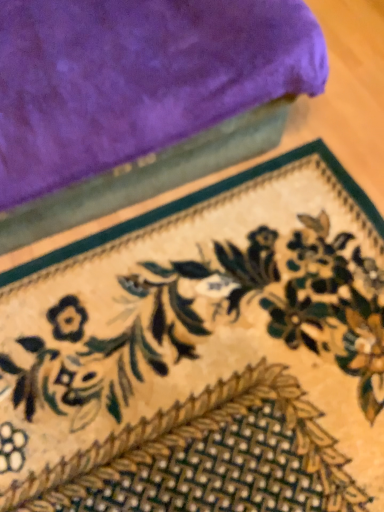
Question: Is floral-patterned carpet at lower center spatially inside velvet purple towel at upper left, or outside of it?

Choices:
 (A) outside
 (B) inside

Answer: (A)

Question: Relative to velvet purple towel at upper left, is floral-patterned carpet at lower center in front or behind?

Choices:
 (A) behind
 (B) front

Answer: (A)

Question: From the image's perspective, is floral-patterned carpet at lower center above or below velvet purple towel at upper left?

Choices:
 (A) above
 (B) below

Answer: (B)

Question: Considering the positions of velvet purple towel at upper left and floral-patterned carpet at lower center in the image, is velvet purple towel at upper left wider or thinner than floral-patterned carpet at lower center?

Choices:
 (A) thin
 (B) wide

Answer: (A)

Question: Based on their positions, is velvet purple towel at upper left located to the left or right of floral-patterned carpet at lower center?

Choices:
 (A) right
 (B) left

Answer: (B)

Question: Based on their sizes in the image, would you say velvet purple towel at upper left is bigger or smaller than floral-patterned carpet at lower center?

Choices:
 (A) big
 (B) small

Answer: (A)

Question: From a real-world perspective, is velvet purple towel at upper left physically located above or below floral-patterned carpet at lower center?

Choices:
 (A) below
 (B) above

Answer: (B)